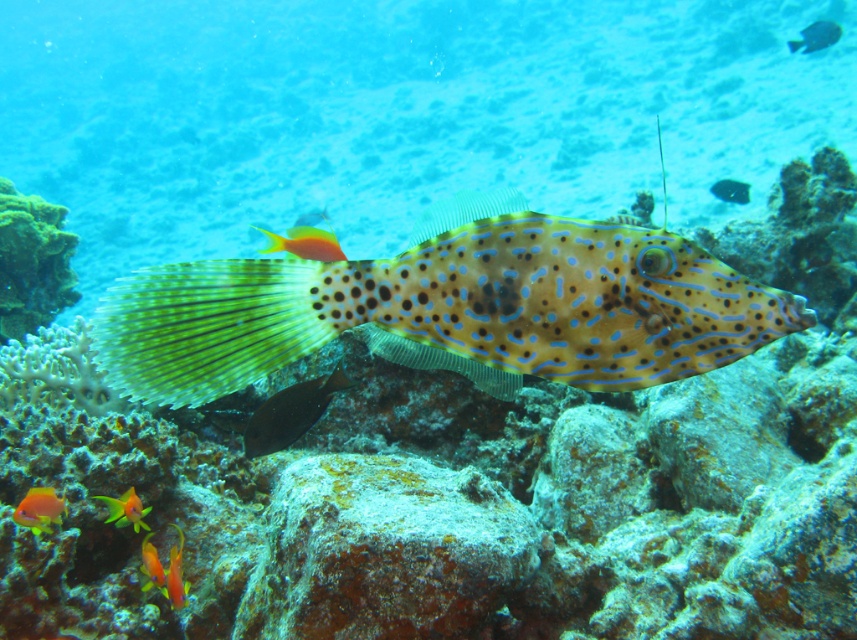
Question: Does shiny dark blue fish at center have a larger size compared to spotted yellow-green at center?

Choices:
 (A) no
 (B) yes

Answer: (B)

Question: Does orange-yellow textured fish at lower left appear under spotted yellow-green at center?

Choices:
 (A) no
 (B) yes

Answer: (B)

Question: Which object is farther from the camera taking this photo?

Choices:
 (A) orange-yellow textured fish at lower left
 (B) orange-yellow coral at lower left

Answer: (A)

Question: Which of these objects is positioned closest to the shiny dark blue fish at center?

Choices:
 (A) spotted yellow-green at center
 (B) orange-yellow coral at lower left
 (C) translucent blue water at center
 (D) spotted orange fish at upper right

Answer: (B)

Question: Is orange glossy fish at lower left thinner than spotted yellow-green at center?

Choices:
 (A) yes
 (B) no

Answer: (A)

Question: Among these objects, which one is nearest to the camera?

Choices:
 (A) spotted orange fish at upper right
 (B) orange glossy fish at lower left

Answer: (B)